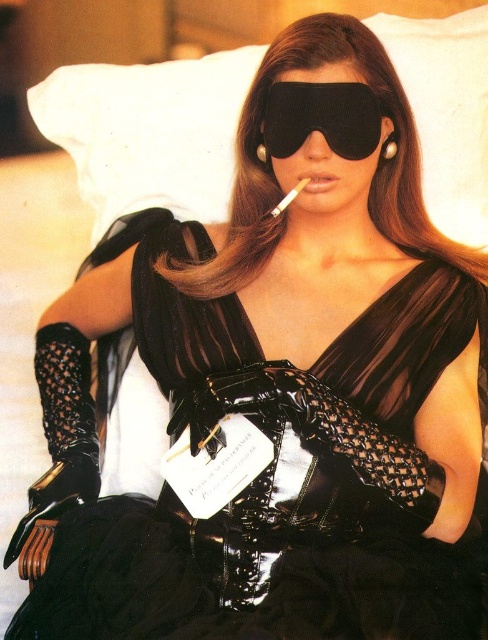
Who is lower down, black glossy dress at center or white fabric pillow at upper center?

black glossy dress at center

Who is more distant from viewer, [417,362] or [196,90]?

Positioned behind is point [196,90].

The width and height of the screenshot is (488, 640). What do you see at coordinates (256, 477) in the screenshot?
I see `black glossy dress at center` at bounding box center [256, 477].

This screenshot has height=640, width=488. In order to click on black glossy dress at center in this screenshot , I will do [x=256, y=477].

Does point (151, 195) come behind point (323, 189)?

Yes.

Between white fabric pillow at upper center and matte black lips at center, which one is positioned lower?

matte black lips at center is below.

Which is behind, point (183, 68) or point (324, 182)?

The point (183, 68) is behind.

At what (x,y) coordinates should I click in order to perform the action: click on white fabric pillow at upper center. Please return your answer as a coordinate pair (x, y). The height and width of the screenshot is (640, 488). Looking at the image, I should click on (148, 131).

Is point (146, 621) farther from camera compared to point (299, 182)?

No, it is not.

Find the location of a particular element. The image size is (488, 640). black glossy dress at center is located at coordinates (256, 477).

The image size is (488, 640). Find the location of `black glossy dress at center`. black glossy dress at center is located at coordinates (256, 477).